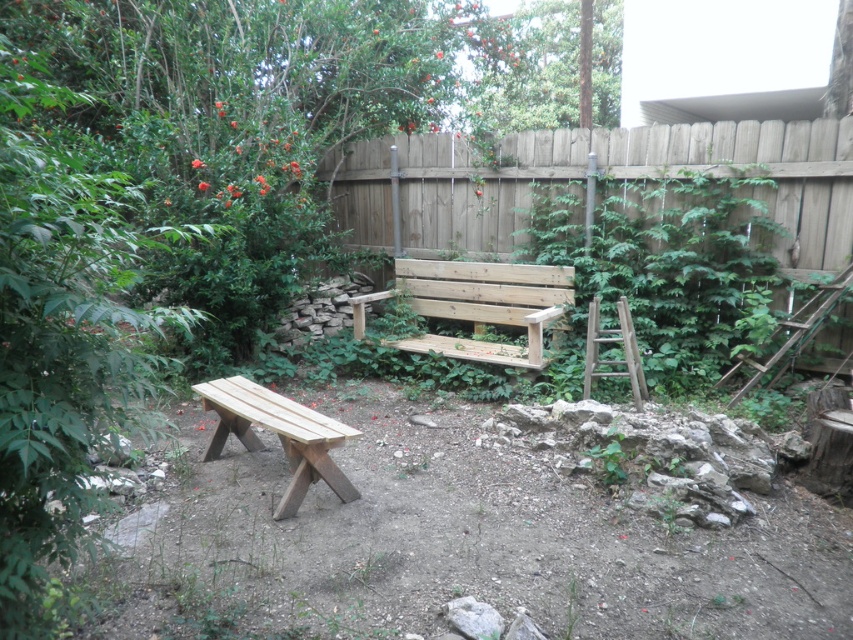
Question: Is wooden bench at center to the left of natural wood bench at lower left from the viewer's perspective?

Choices:
 (A) no
 (B) yes

Answer: (A)

Question: Which point is farther to the camera?

Choices:
 (A) (357, 328)
 (B) (250, 451)

Answer: (A)

Question: Is wooden bench at center smaller than natural wood bench at lower left?

Choices:
 (A) yes
 (B) no

Answer: (B)

Question: Is wooden bench at center above natural wood bench at lower left?

Choices:
 (A) yes
 (B) no

Answer: (A)

Question: Which point appears closest to the camera in this image?

Choices:
 (A) (229, 385)
 (B) (479, 316)

Answer: (A)